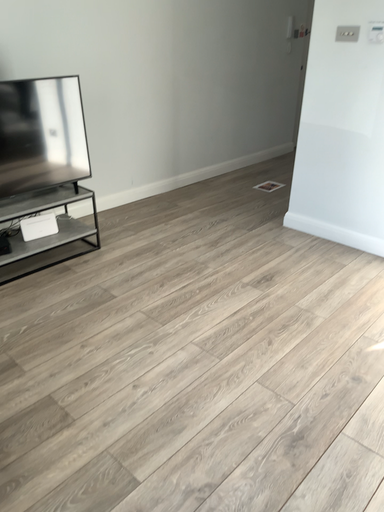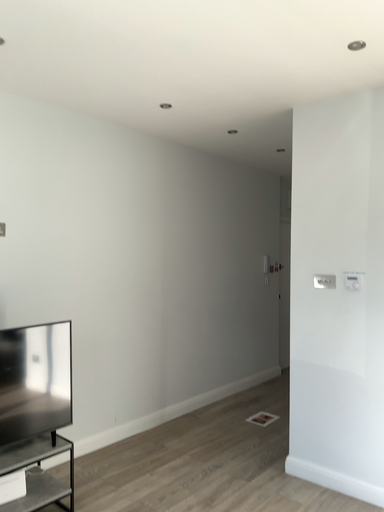
Question: Which way did the camera rotate in the video?

Choices:
 (A) rotated downward
 (B) rotated upward

Answer: (B)